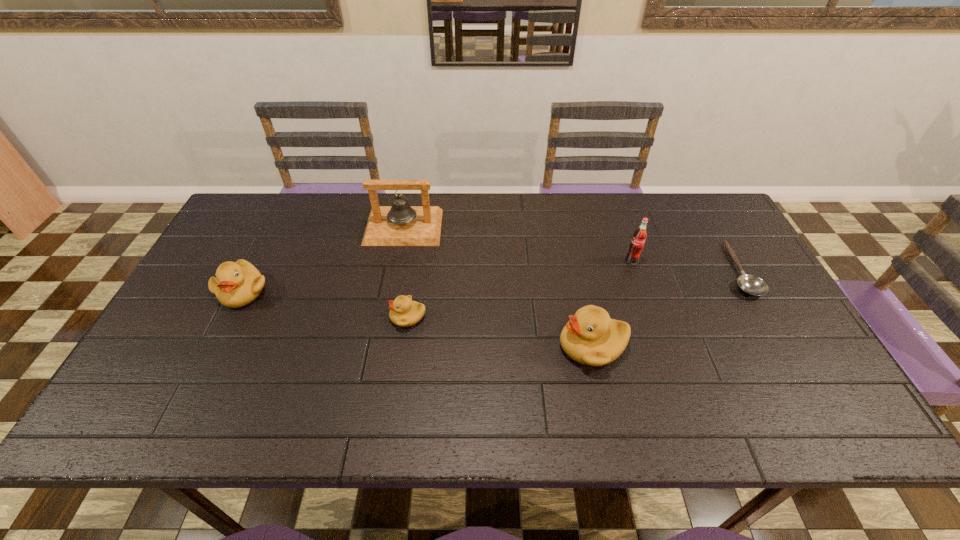
Where is `the third shortest object`? The height and width of the screenshot is (540, 960). the third shortest object is located at coordinates (236, 284).

This screenshot has width=960, height=540. I want to click on the leftmost duckling, so click(x=236, y=284).

The height and width of the screenshot is (540, 960). What are the coordinates of `the fifth tallest object` in the screenshot? It's located at (404, 312).

Identify the location of the shortest duckling. (404, 312).

Where is `the third object from right to left`? the third object from right to left is located at coordinates (590, 337).

This screenshot has width=960, height=540. What are the coordinates of `soda bottle` in the screenshot? It's located at (637, 243).

You are a GUI agent. You are given a task and a screenshot of the screen. Output one action in this format:
    pyautogui.click(x=<x>, y=<y>)
    Task: Click on the bell
    The image size is (960, 540).
    Given the screenshot: What is the action you would take?
    pyautogui.click(x=400, y=224)

At what (x,y) coordinates should I click in order to perform the action: click on the rightmost object. Please return your answer as a coordinate pair (x, y). The width and height of the screenshot is (960, 540). Looking at the image, I should click on (750, 284).

I want to click on the shortest object, so click(x=750, y=284).

The height and width of the screenshot is (540, 960). What are the coordinates of `free space located at the beak of the fourth tallest object` in the screenshot? It's located at (217, 342).